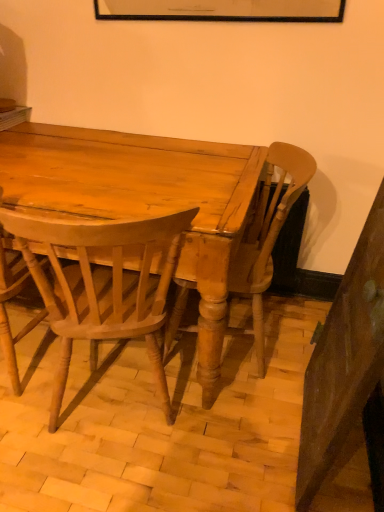
Question: Is light brown wood chair at center, which ranks as the 1th chair in left-to-right order, inside the boundaries of light brown wood chair at center, placed as the 1th chair when sorted from right to left, or outside?

Choices:
 (A) outside
 (B) inside

Answer: (A)

Question: Does point (0, 333) appear closer or farther from the camera than point (276, 211)?

Choices:
 (A) closer
 (B) farther

Answer: (B)

Question: Which object is the closest to the light brown wood chair at center, which ranks as the 1th chair in left-to-right order?

Choices:
 (A) matte wood desk at center
 (B) light brown wood chair at center, the 2th chair from the right
 (C) light brown wood chair at center, marked as the third chair in a left-to-right arrangement

Answer: (B)

Question: Which is nearer to the matte wood desk at center?

Choices:
 (A) light brown wood chair at center, the 2th chair from the right
 (B) light brown wood chair at center, which ranks as the 1th chair in left-to-right order
 (C) light brown wood chair at center, marked as the third chair in a left-to-right arrangement

Answer: (A)